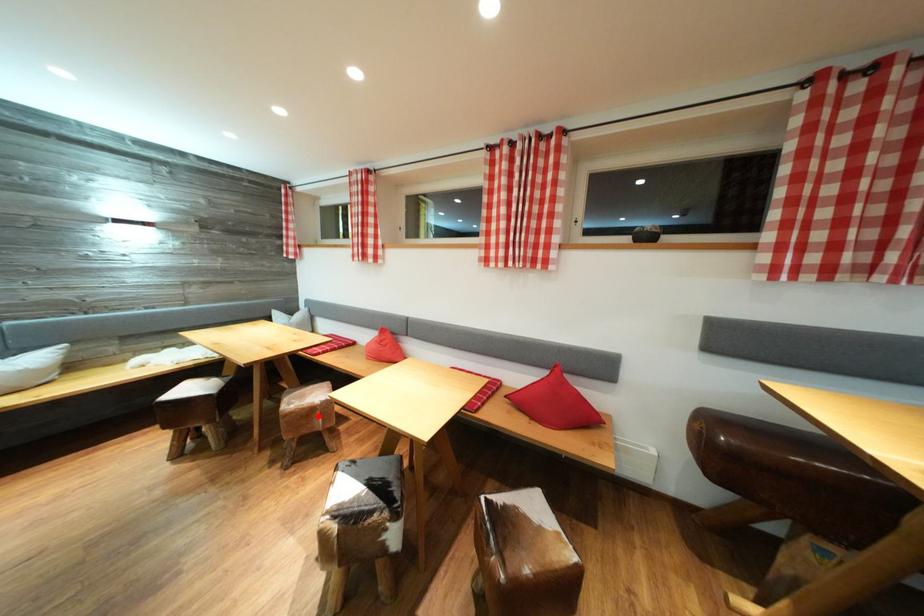
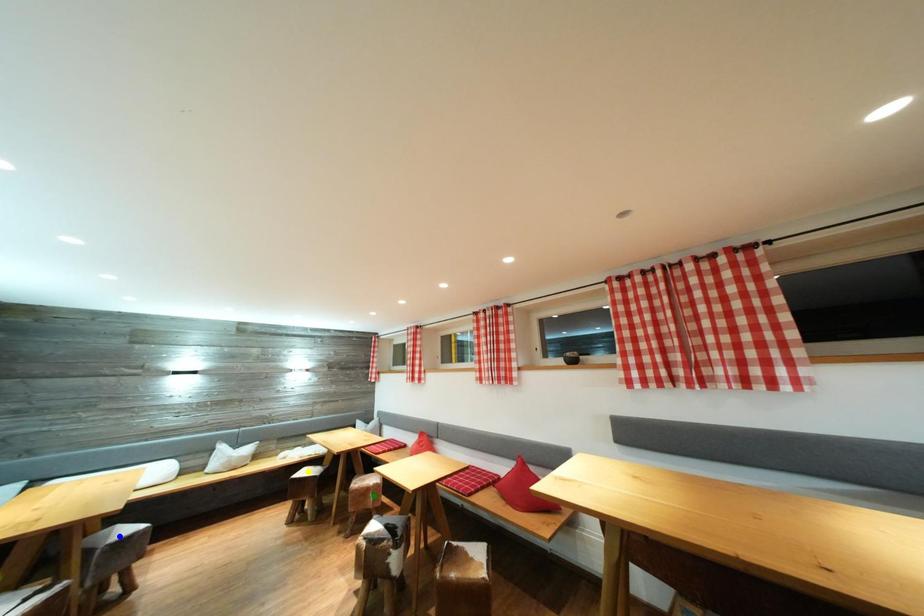
Question: I am providing you with two images of the same scene from different viewpoints. A red point is marked on the first image. You are given multiple points on the second image. In image 2, which mark is for the same physical point as the one in image 1?

Choices:
 (A) green point
 (B) blue point
 (C) yellow point

Answer: (A)